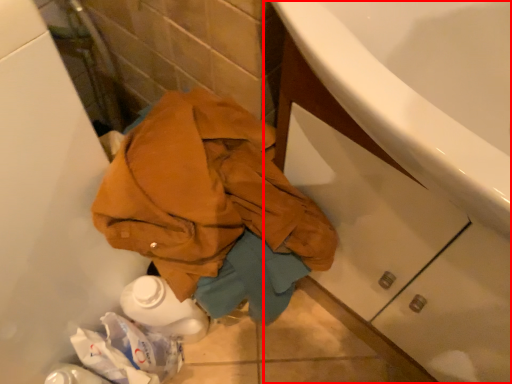
Question: From the image's perspective, where is bathroom cabinet (annotated by the red box) located in relation to clothing in the image?

Choices:
 (A) below
 (B) above

Answer: (B)